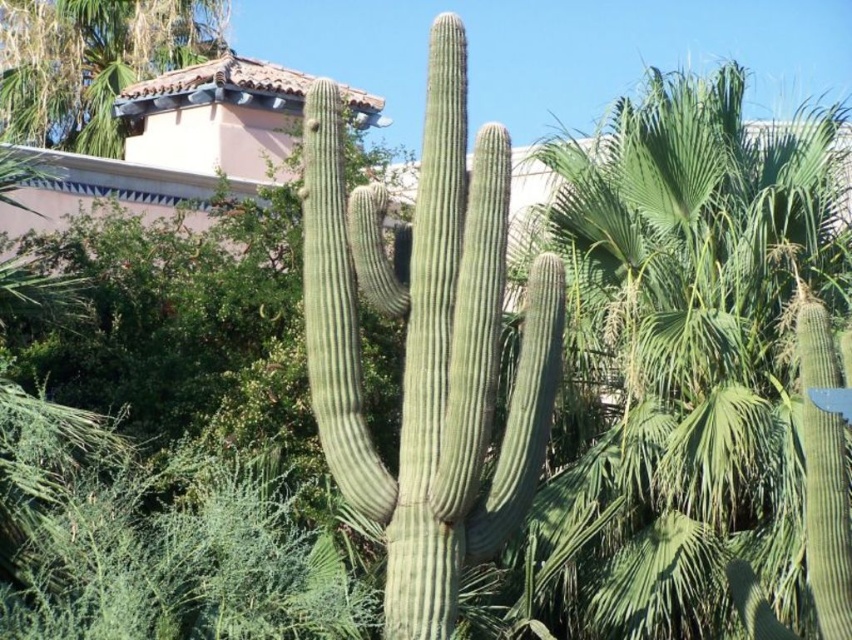
Question: Is green spiny cactus at center in front of green matte cactus at upper left?

Choices:
 (A) yes
 (B) no

Answer: (A)

Question: Is green leafy palm tree at center bigger than green matte cactus at upper left?

Choices:
 (A) no
 (B) yes

Answer: (A)

Question: Where is green leafy palm tree at center located in relation to green matte cactus at upper left in the image?

Choices:
 (A) below
 (B) above

Answer: (A)

Question: Estimate the real-world distances between objects in this image. Which object is closer to the green leafy palm tree at center?

Choices:
 (A) green spiny cactus at center
 (B) green matte cactus at upper left

Answer: (A)

Question: Among these objects, which one is farthest from the camera?

Choices:
 (A) green matte cactus at upper left
 (B) green spiny cactus at center

Answer: (A)

Question: Which point is farther to the camera?

Choices:
 (A) green leafy palm tree at center
 (B) green matte cactus at upper left

Answer: (B)